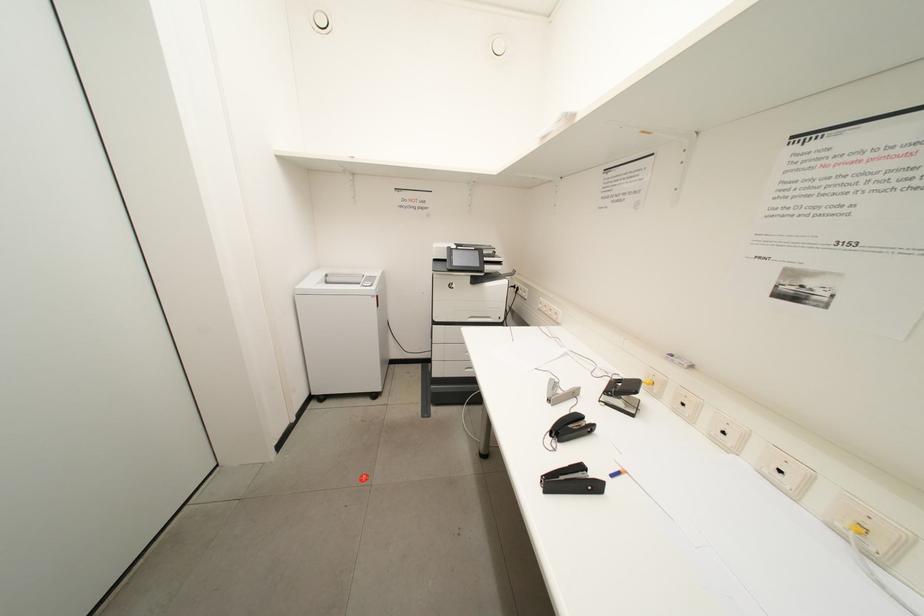
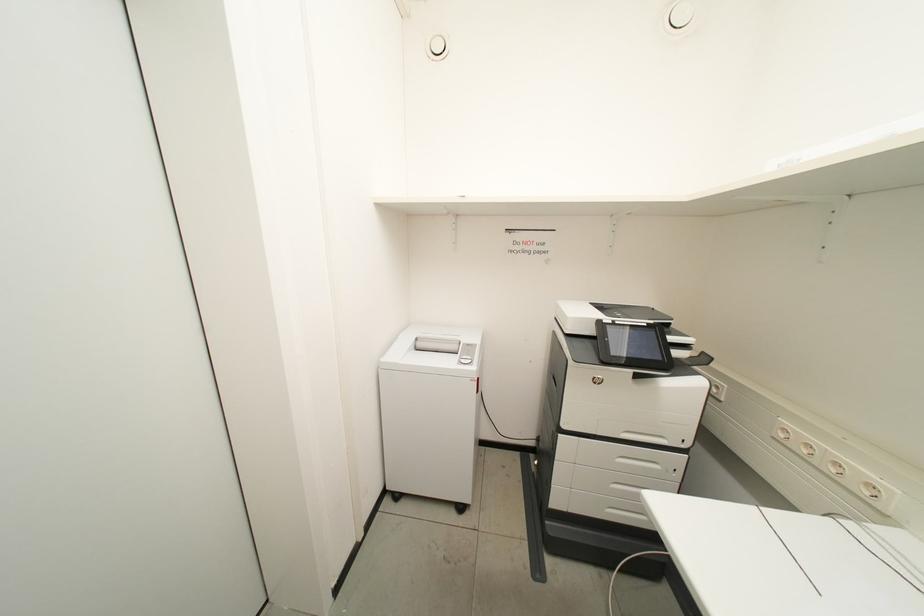
The images are taken continuously from a first-person perspective. In which direction are you moving?

The cameraman walked toward left, forward.